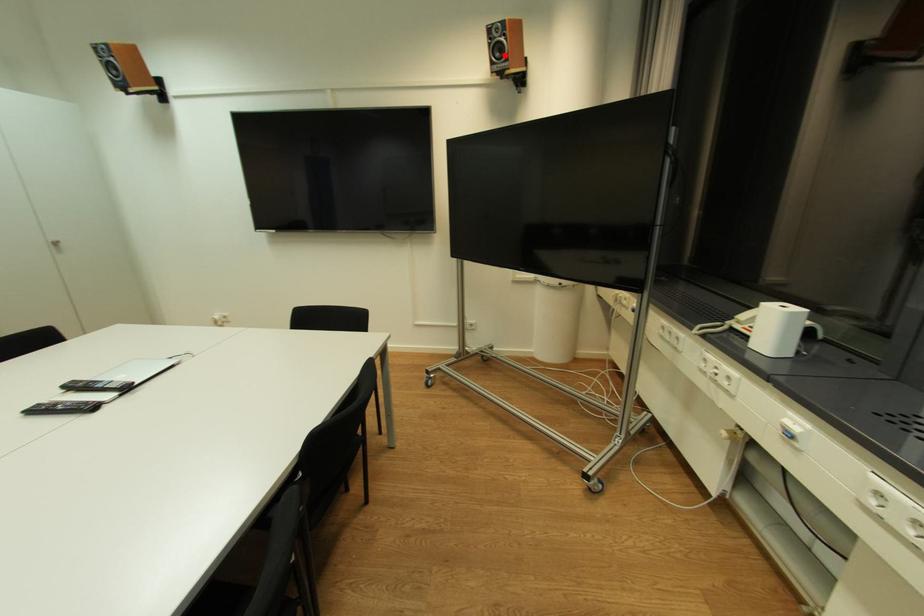
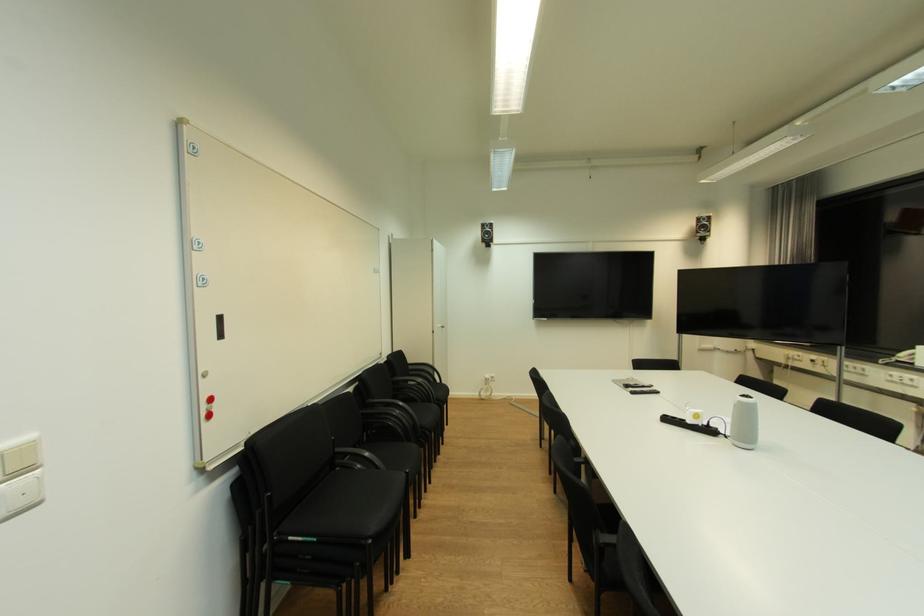
Question: I am providing you with two images of the same scene from different viewpoints. A red point is marked on the first image. Is the red point's position out of view in image 2?

Choices:
 (A) Yes
 (B) No

Answer: (B)